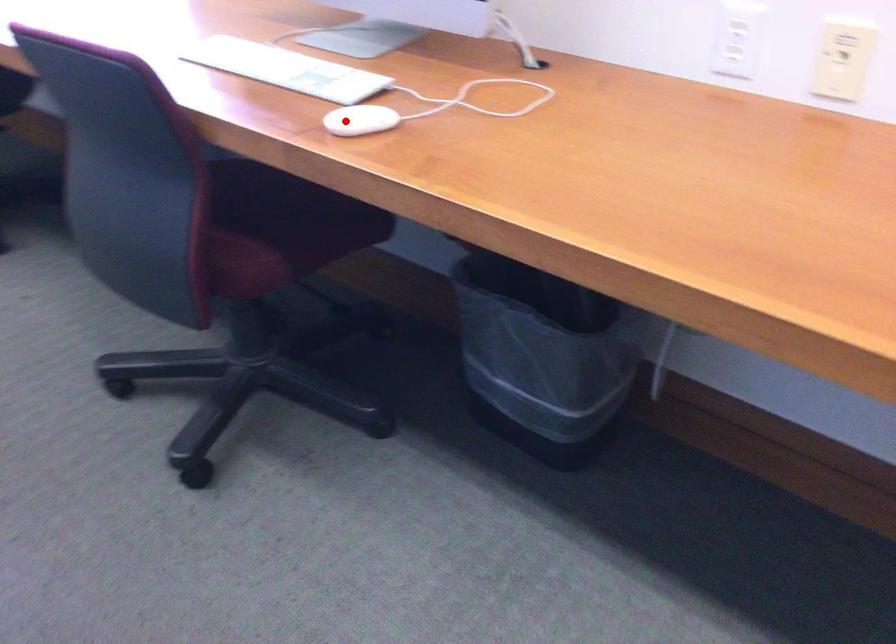
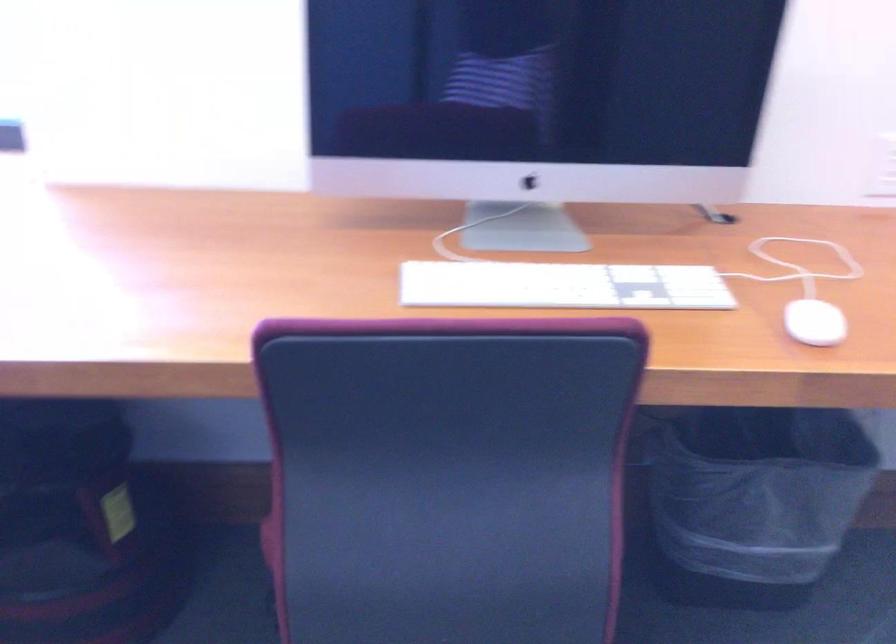
Question: I am providing you with two images of the same scene from different viewpoints. A red point is marked on the first image. At the location where the point appears in image 1, is it still visible in image 2?

Choices:
 (A) Yes
 (B) No

Answer: (A)